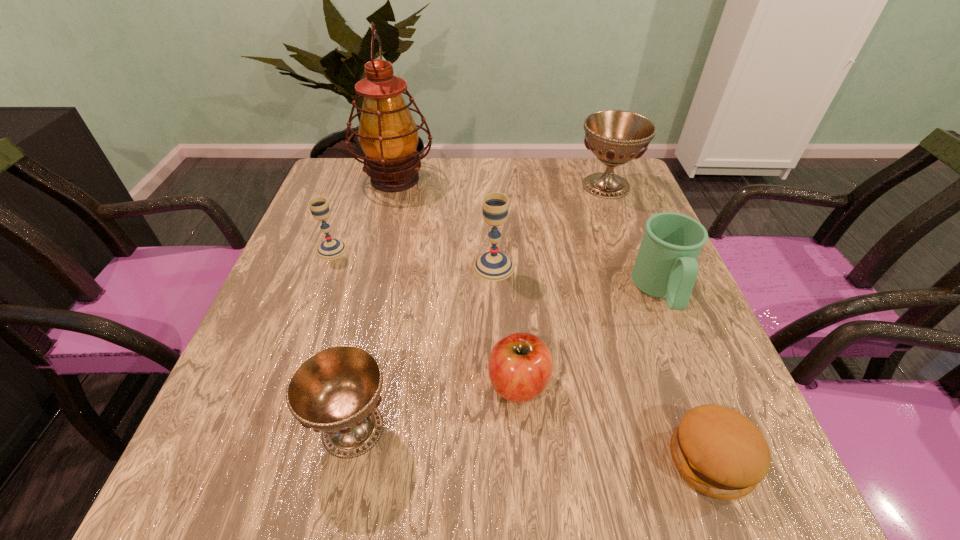
The image size is (960, 540). In order to click on oil lamp in this screenshot , I will do `click(388, 135)`.

At what (x,y) coordinates should I click in order to perform the action: click on the rightmost chalice. Please return your answer as a coordinate pair (x, y). This screenshot has height=540, width=960. Looking at the image, I should click on (615, 137).

Where is `the farthest chalice`? the farthest chalice is located at coordinates (615, 137).

Find the location of `the third chalice from left to right`. the third chalice from left to right is located at coordinates (492, 266).

The height and width of the screenshot is (540, 960). Identify the location of the bigger gray chalice. (492, 266).

You are a GUI agent. You are given a task and a screenshot of the screen. Output one action in this format:
    pyautogui.click(x=<x>, y=<y>)
    Task: Click on the green mug
    
    Given the screenshot: What is the action you would take?
    pyautogui.click(x=666, y=266)

The image size is (960, 540). What are the coordinates of `the left gray chalice` in the screenshot? It's located at (330, 249).

Identify the location of the leftmost chalice. The image size is (960, 540). (330, 249).

The width and height of the screenshot is (960, 540). Identify the location of the third chalice from right to left. (336, 390).

Find the location of a particular element. The height and width of the screenshot is (540, 960). the smaller red chalice is located at coordinates (336, 390).